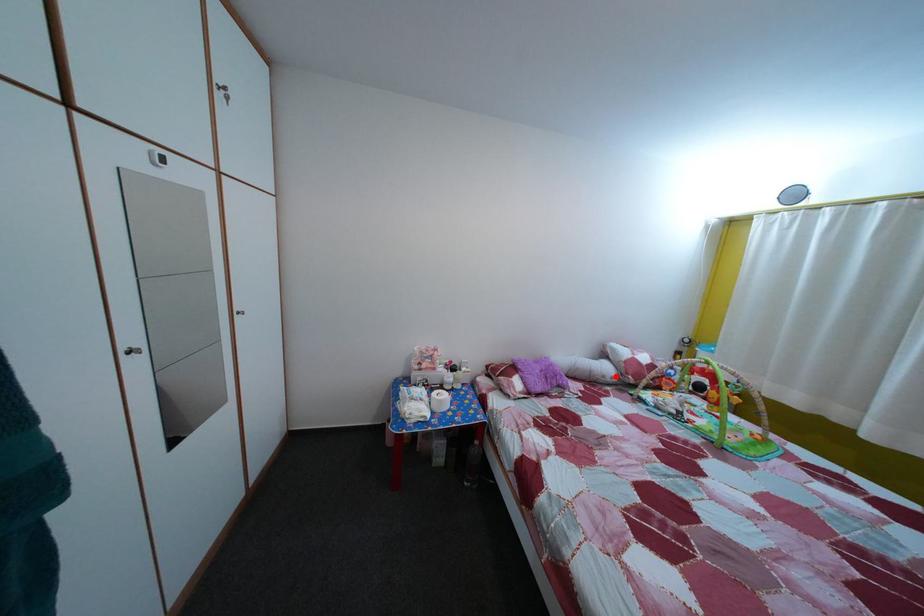
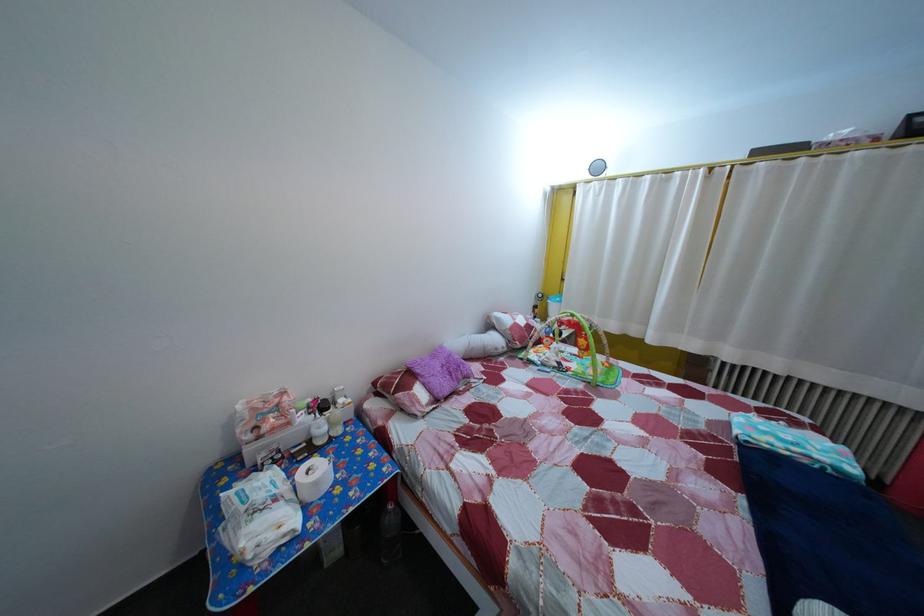
In the second image, find the point that corresponds to the highlighted location in the first image.

(505, 347)